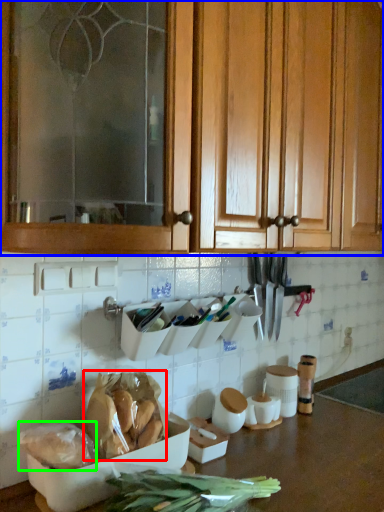
Question: Which object is positioned closest to food (highlighted by a red box)? Select from cabinetry (highlighted by a blue box) and food (highlighted by a green box).

Choices:
 (A) cabinetry
 (B) food

Answer: (B)